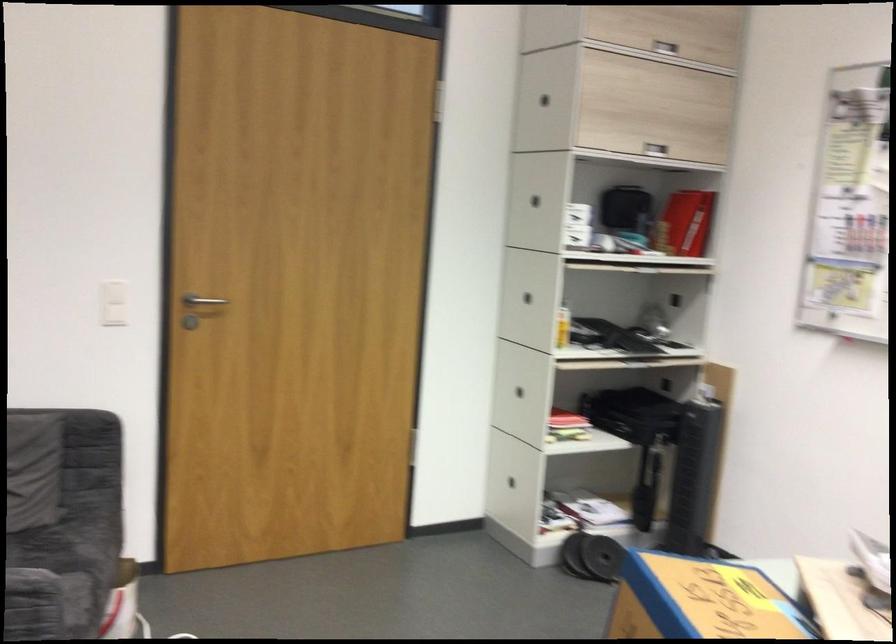
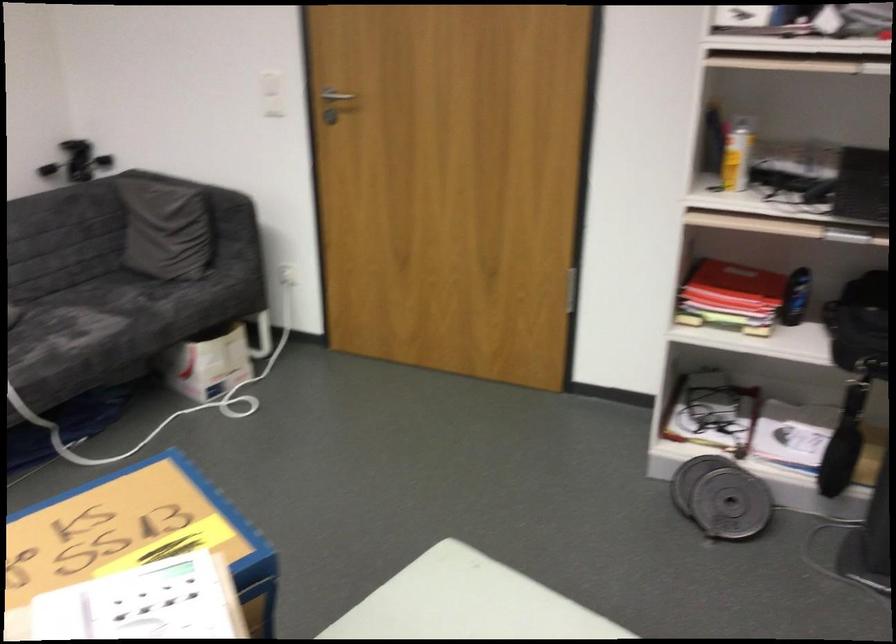
Find the pixel in the second image that matches (x=643, y=415) in the first image.

(859, 325)